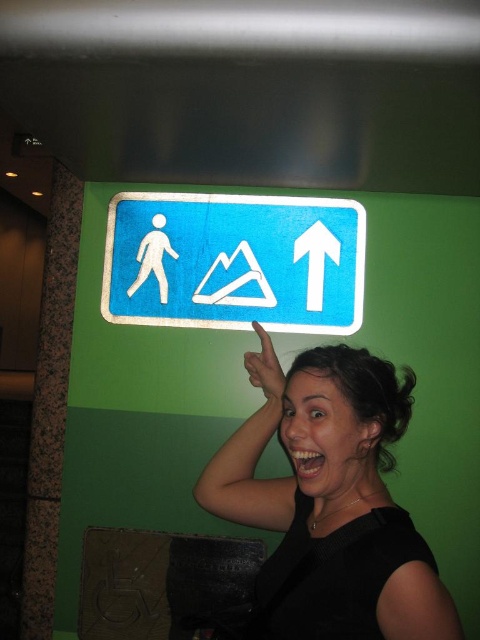
Based on the photo, is blue plastic sign at upper center to the right of white plastic arrow at upper center from the viewer's perspective?

Incorrect, blue plastic sign at upper center is not on the right side of white plastic arrow at upper center.

Is blue plastic sign at upper center in front of white plastic arrow at upper center?

Yes, it is in front of white plastic arrow at upper center.

Identify the location of blue plastic sign at upper center. (235, 260).

Find the location of a particular element. blue plastic sign at upper center is located at coordinates (235, 260).

Who is shorter, black matte hair at upper right or blue plastic sign at upper center?

blue plastic sign at upper center is shorter.

Can you confirm if black matte hair at upper right is shorter than blue plastic sign at upper center?

Incorrect, black matte hair at upper right's height does not fall short of blue plastic sign at upper center's.

Find the location of `black matte hair at upper right`. black matte hair at upper right is located at coordinates (330, 502).

Can you confirm if white glossy arrow at upper center is wider than white plastic arrow at upper center?

No.

Can you confirm if white glossy arrow at upper center is taller than white plastic arrow at upper center?

Correct, white glossy arrow at upper center is much taller as white plastic arrow at upper center.

Is point (312, 246) positioned in front of point (272, 298)?

No.

Identify the location of white glossy arrow at upper center. The image size is (480, 640). (315, 259).